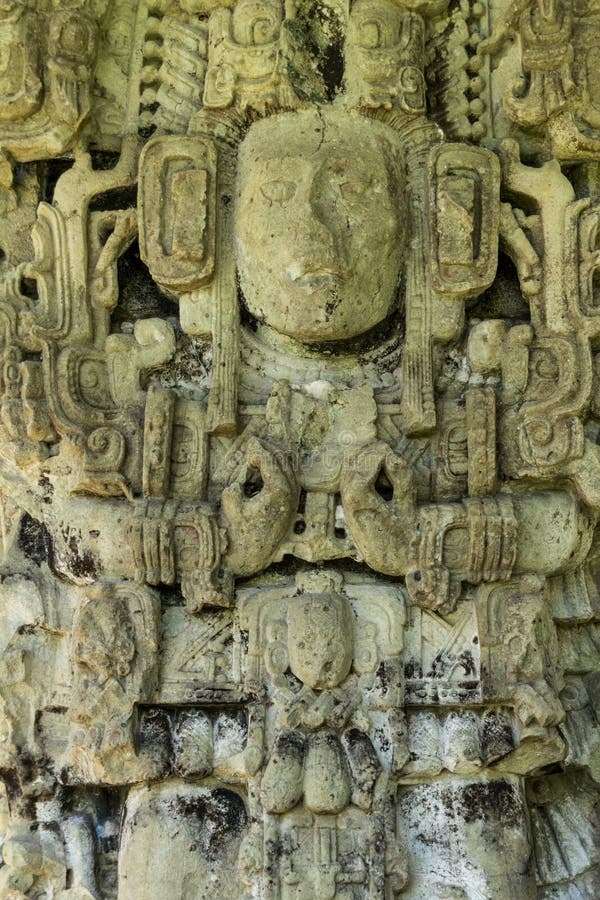
In order to click on statue in this screenshot , I will do `click(326, 417)`.